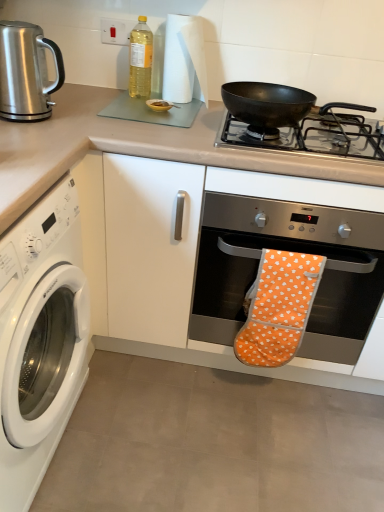
Question: Is orange fabric oven mitt at center at the left side of white paper towel at upper center?

Choices:
 (A) no
 (B) yes

Answer: (A)

Question: Considering the relative sizes of orange fabric oven mitt at center and white paper towel at upper center in the image provided, is orange fabric oven mitt at center thinner than white paper towel at upper center?

Choices:
 (A) no
 (B) yes

Answer: (A)

Question: From a real-world perspective, does orange fabric oven mitt at center sit lower than white paper towel at upper center?

Choices:
 (A) yes
 (B) no

Answer: (A)

Question: Does orange fabric oven mitt at center have a lesser height compared to white paper towel at upper center?

Choices:
 (A) yes
 (B) no

Answer: (B)

Question: Would you say white paper towel at upper center is part of orange fabric oven mitt at center's contents?

Choices:
 (A) yes
 (B) no

Answer: (B)

Question: Which is correct: matte glass cutting board at upper center is inside orange fabric oven mitt at center, or outside of it?

Choices:
 (A) inside
 (B) outside

Answer: (B)

Question: In the image, is matte glass cutting board at upper center positioned in front of or behind orange fabric oven mitt at center?

Choices:
 (A) behind
 (B) front

Answer: (B)

Question: Based on their sizes in the image, would you say matte glass cutting board at upper center is bigger or smaller than orange fabric oven mitt at center?

Choices:
 (A) big
 (B) small

Answer: (A)

Question: From their relative heights in the image, would you say matte glass cutting board at upper center is taller or shorter than orange fabric oven mitt at center?

Choices:
 (A) short
 (B) tall

Answer: (B)

Question: Would you say white paper towel at upper center is inside or outside orange fabric oven mitt at center?

Choices:
 (A) inside
 (B) outside

Answer: (B)

Question: Is white paper towel at upper center wider or thinner than orange fabric oven mitt at center?

Choices:
 (A) wide
 (B) thin

Answer: (A)

Question: Considering the positions of white paper towel at upper center and orange fabric oven mitt at center in the image, is white paper towel at upper center taller or shorter than orange fabric oven mitt at center?

Choices:
 (A) short
 (B) tall

Answer: (A)

Question: Does point (170, 29) appear closer or farther from the camera than point (299, 294)?

Choices:
 (A) farther
 (B) closer

Answer: (A)

Question: Considering the positions of white glossy washing machine at left and orange fabric oven mitt at center in the image, is white glossy washing machine at left wider or thinner than orange fabric oven mitt at center?

Choices:
 (A) thin
 (B) wide

Answer: (B)

Question: From a real-world perspective, is white glossy washing machine at left above or below orange fabric oven mitt at center?

Choices:
 (A) below
 (B) above

Answer: (B)